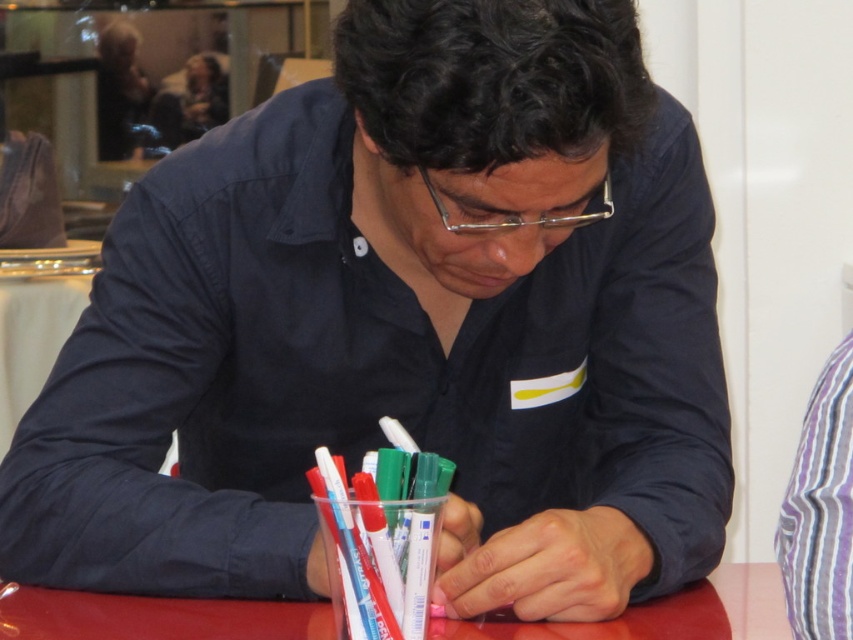
You are standing in front of the scene and want to place a small object on the purple striped shirt at right. Can you place it directly above the red glossy table at center?

The red glossy table at center is located below the purple striped shirt at right, so yes, placing the object directly above the red glossy table at center would also place it above the purple striped shirt at right.

You are standing at the origin point in the image. There are two points marked in the scene. Which point is closer to you, point 1 at coordinates (0, 624) or point 2 at coordinates (837, 528)?

Point 2 at coordinates (837, 528) is closer to you because in the image, point 1 at coordinates (0, 624) is behind point 2 at coordinates (837, 528).